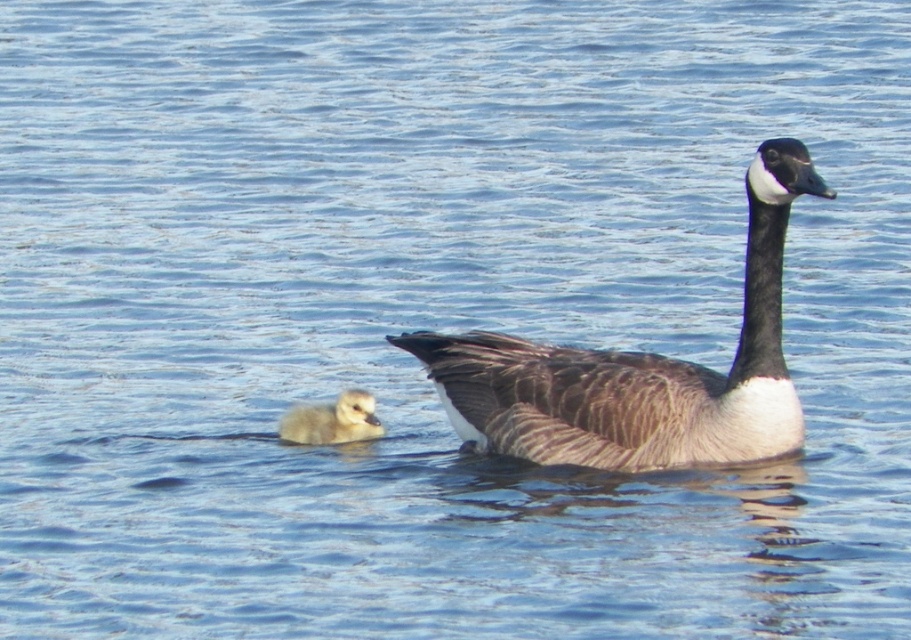
Question: Can you confirm if brown textured goose at center is thinner than light brown downy gosling at lower left?

Choices:
 (A) no
 (B) yes

Answer: (A)

Question: Which point is farther from the camera taking this photo?

Choices:
 (A) (735, 454)
 (B) (323, 420)

Answer: (B)

Question: In this image, where is brown textured goose at center located relative to light brown downy gosling at lower left?

Choices:
 (A) below
 (B) above

Answer: (B)

Question: Where is brown textured goose at center located in relation to light brown downy gosling at lower left in the image?

Choices:
 (A) above
 (B) below

Answer: (A)

Question: Which point is farther to the camera?

Choices:
 (A) light brown downy gosling at lower left
 (B) brown textured goose at center

Answer: (A)